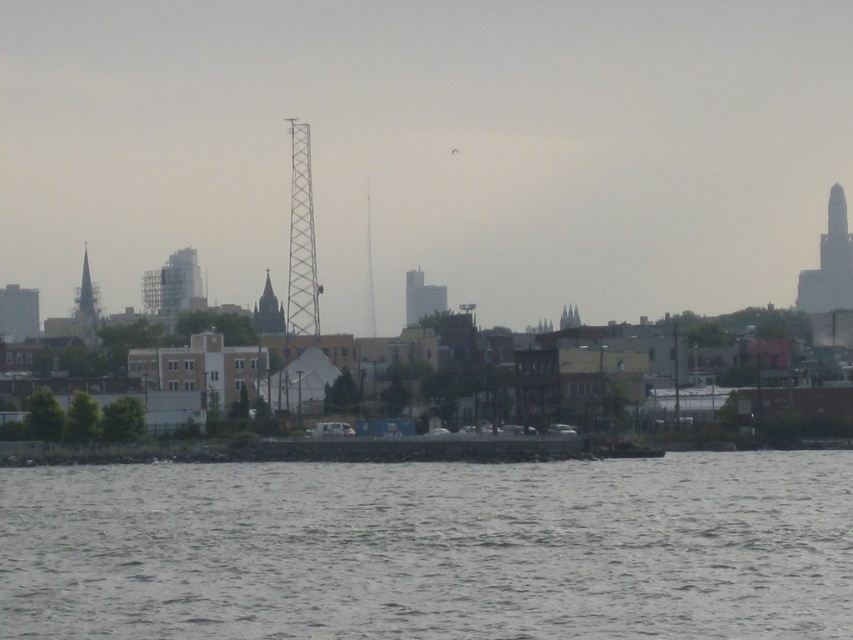
You are standing on the dock and want to take a photo of the smooth glass skyscraper at right and the smooth gray tower at center. Which one should you zoom in on first to ensure it appears larger in your photo?

The smooth glass skyscraper at right is closer to you than the smooth gray tower at center, so it will naturally appear larger in the photo without needing to zoom in as much. However, if you want both to be similarly sized, you should zoom in more on the smooth gray tower at center to compensate for its distance.

You are a city planner reviewing this area. You need to install a new antenna on the tallest structure between the metallic tower at center and the smooth glass skyscraper at right. Which structure should you choose?

The metallic tower at center is larger in size than the smooth glass skyscraper at right, so you should install the antenna on the metallic tower at center since it is taller.

You are a drone operator who needs to fly a drone from the metallic tower at center to the smooth glass skyscraper at right. According to the scene description, which direction should you fly the drone to reach the skyscraper?

The metallic tower at center is positioned over the smooth glass skyscraper at right, so you should fly the drone downward to reach the smooth glass skyscraper at right.